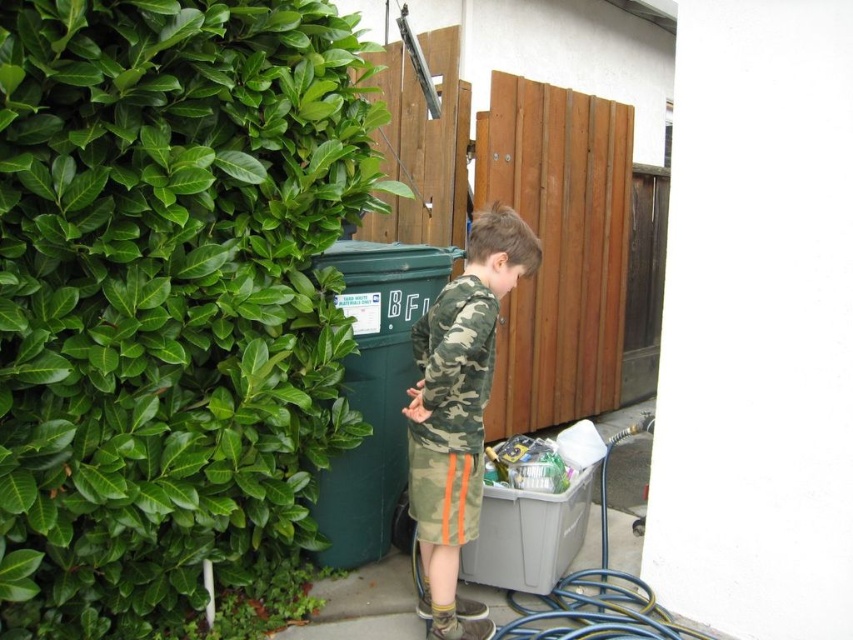
Question: Can you confirm if green plastic recycling bin at center-left is wider than blue rubber garden hose at lower right?

Choices:
 (A) no
 (B) yes

Answer: (A)

Question: Does green plastic recycling bin at center-left have a larger size compared to blue rubber garden hose at lower right?

Choices:
 (A) no
 (B) yes

Answer: (A)

Question: Among these objects, which one is nearest to the camera?

Choices:
 (A) green leafy hedge at left
 (B) green plastic recycling bin at center-left
 (C) camo fabric shirt at center
 (D) blue rubber garden hose at lower right

Answer: (A)

Question: Among these objects, which one is nearest to the camera?

Choices:
 (A) green leafy hedge at left
 (B) camo fabric shirt at center
 (C) green plastic recycling bin at center-left

Answer: (A)

Question: Can you confirm if green plastic recycling bin at center-left is wider than blue rubber garden hose at lower right?

Choices:
 (A) yes
 (B) no

Answer: (B)

Question: Which of these objects is positioned farthest from the green leafy hedge at left?

Choices:
 (A) green plastic recycling bin at center-left
 (B) blue rubber garden hose at lower right

Answer: (B)